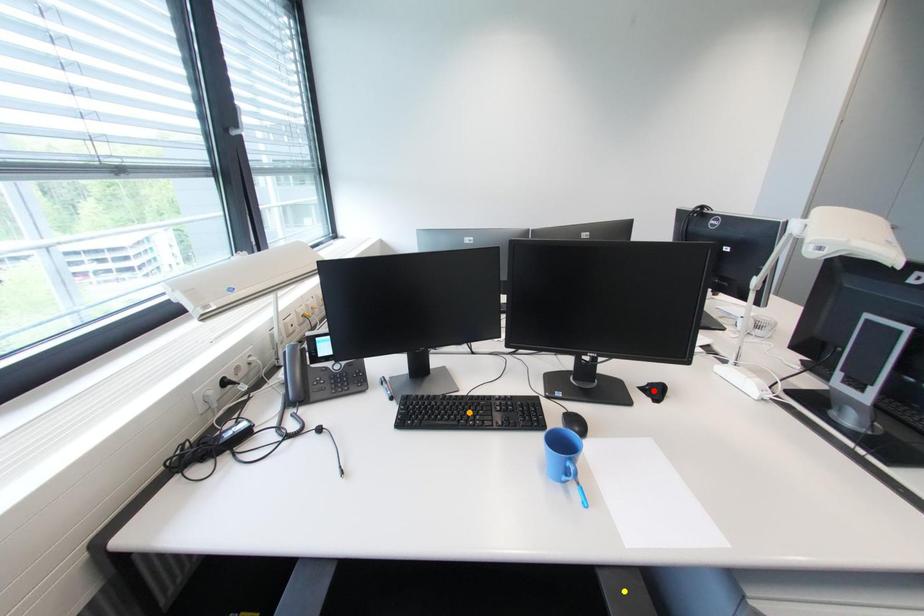
Order these from nearest to farthest:
A) red point
B) orange point
C) yellow point

yellow point → orange point → red point